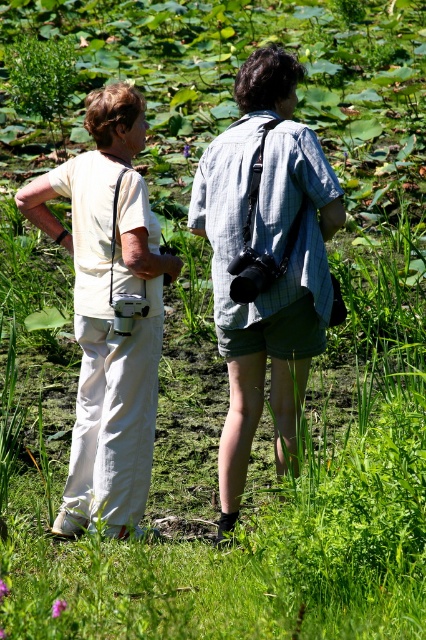
Is matte blue shirt at center wider than white cotton pants at left?

No, matte blue shirt at center is not wider than white cotton pants at left.

Is matte blue shirt at center positioned behind white cotton pants at left?

No, matte blue shirt at center is closer to the viewer.

Is point (215, 147) closer to viewer compared to point (95, 381)?

Yes, point (215, 147) is closer to viewer.

Identify the location of matte blue shirt at center. (265, 259).

Which is in front, point (62, 177) or point (63, 166)?

Point (62, 177)

Is point (104, 481) behind point (57, 173)?

No, (104, 481) is closer to viewer.

Describe the element at coordinates (268, 257) in the screenshot. Image resolution: width=426 pixels, height=640 pixels. I see `matte white pants at left` at that location.

In order to click on matte white pants at left in this screenshot , I will do `click(268, 257)`.

Is matte white pants at left shorter than matte blue shirt at center?

Correct, matte white pants at left is not as tall as matte blue shirt at center.

Which is below, matte white pants at left or matte blue shirt at center?

matte white pants at left is lower down.

Which is in front, point (294, 356) or point (287, 429)?

Point (294, 356)

This screenshot has height=640, width=426. In order to click on matte white pants at left in this screenshot , I will do `click(268, 257)`.